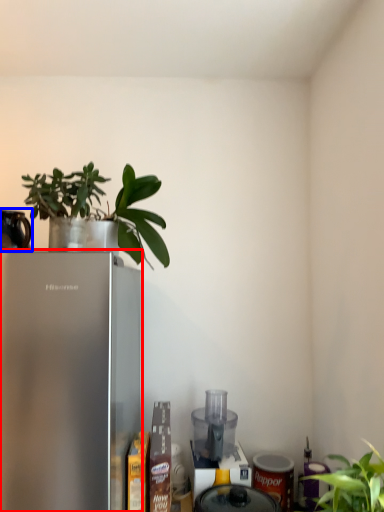
Question: Among these objects, which one is farthest to the camera, refrigerator (highlighted by a red box) or appliance (highlighted by a blue box)?

Choices:
 (A) refrigerator
 (B) appliance

Answer: (B)